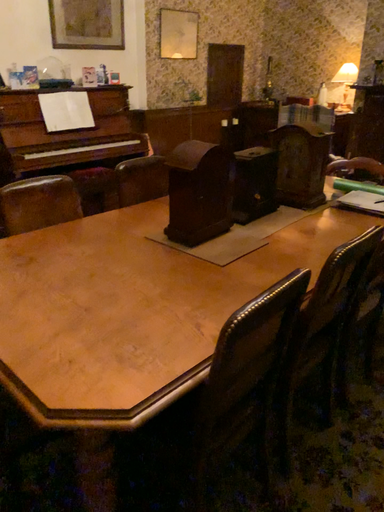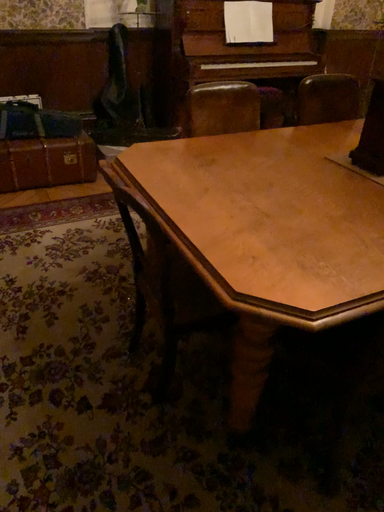
Question: Which way did the camera rotate in the video?

Choices:
 (A) rotated right
 (B) rotated left

Answer: (B)